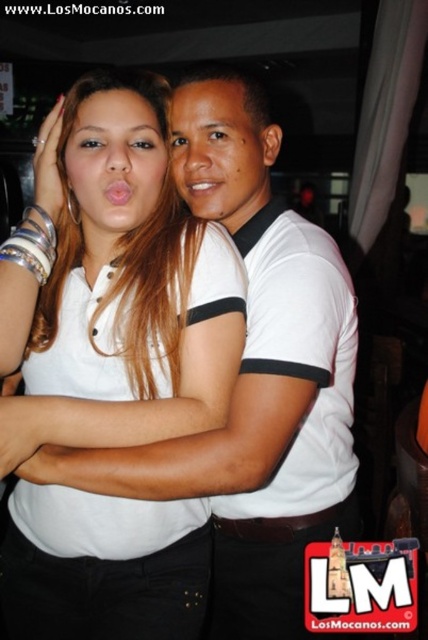
Between white matte shirt at center and white cotton shirt at center, which one has less height?

white matte shirt at center is shorter.

Is white matte shirt at center bigger than white cotton shirt at center?

Incorrect, white matte shirt at center is not larger than white cotton shirt at center.

Locate an element on the screen. Image resolution: width=428 pixels, height=640 pixels. white matte shirt at center is located at coordinates (115, 284).